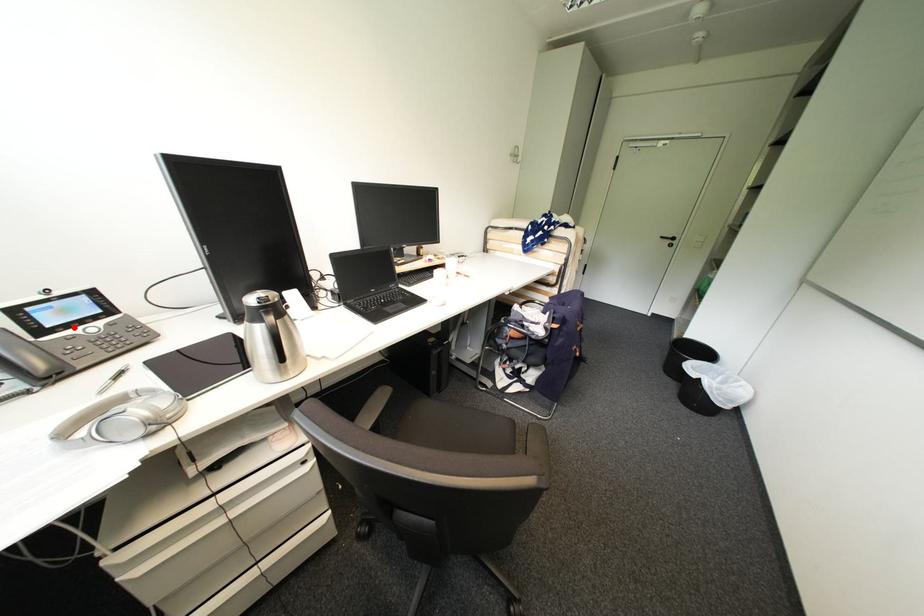
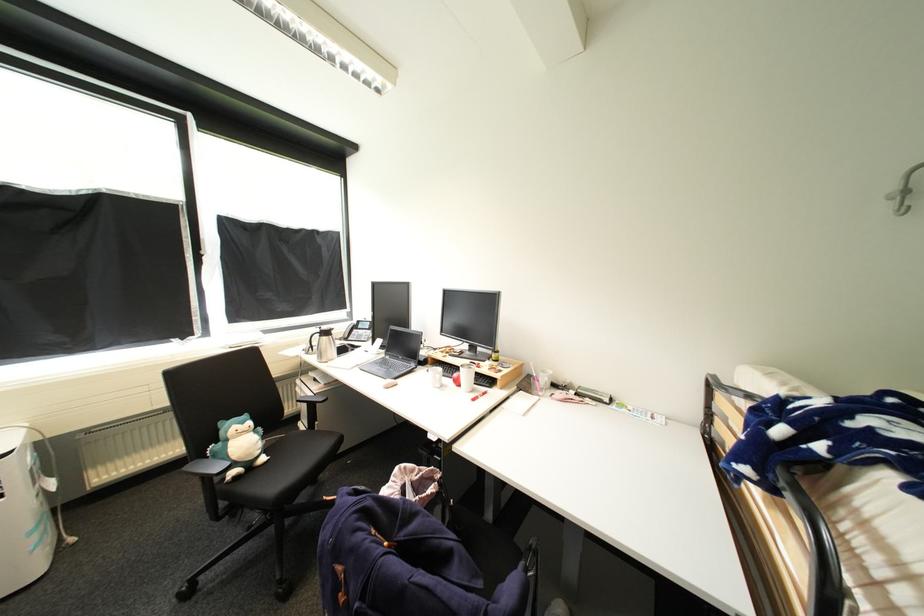
Locate, in the second image, the point that corresponds to the highlighted location in the first image.

(367, 330)